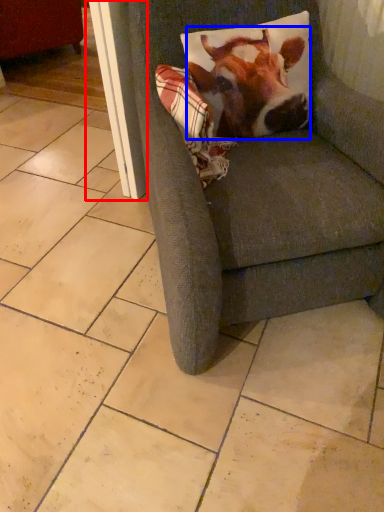
Question: Which of the following is the farthest to the observer, screen door (highlighted by a red box) or cattle (highlighted by a blue box)?

Choices:
 (A) screen door
 (B) cattle

Answer: (A)